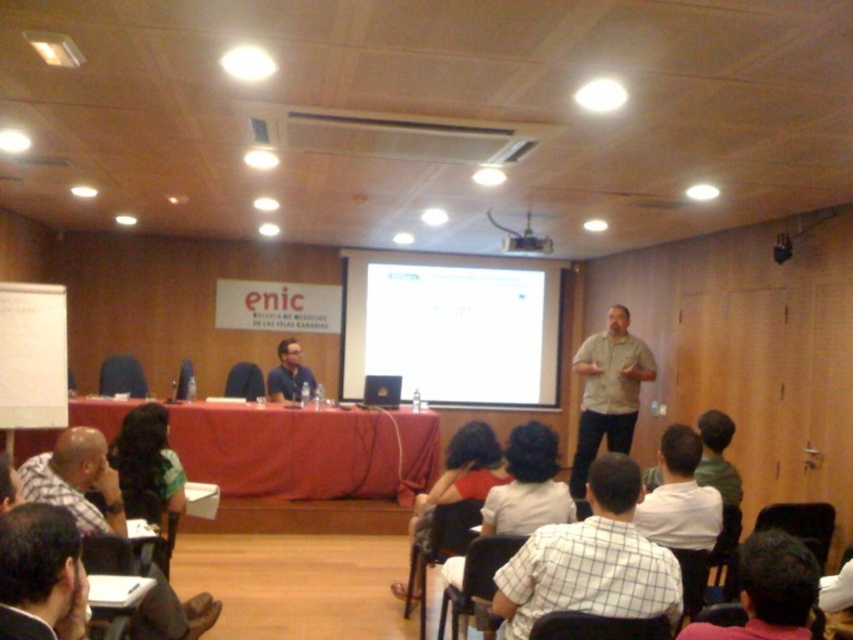
You are an attendee sitting in the audience and want to see both the dark brown hair at lower right and the dark brown hair at center on the stage. Which one is closer to you?

The dark brown hair at lower right is closer to you because it is in front of the dark brown hair at center.

You are sitting in the audience facing the stage. You notice the plaid shirt at lower left and the white glossy projection screen at center. Which object is closer to you?

The plaid shirt at lower left is behind the white glossy projection screen at center, so the white glossy projection screen at center is closer to you.